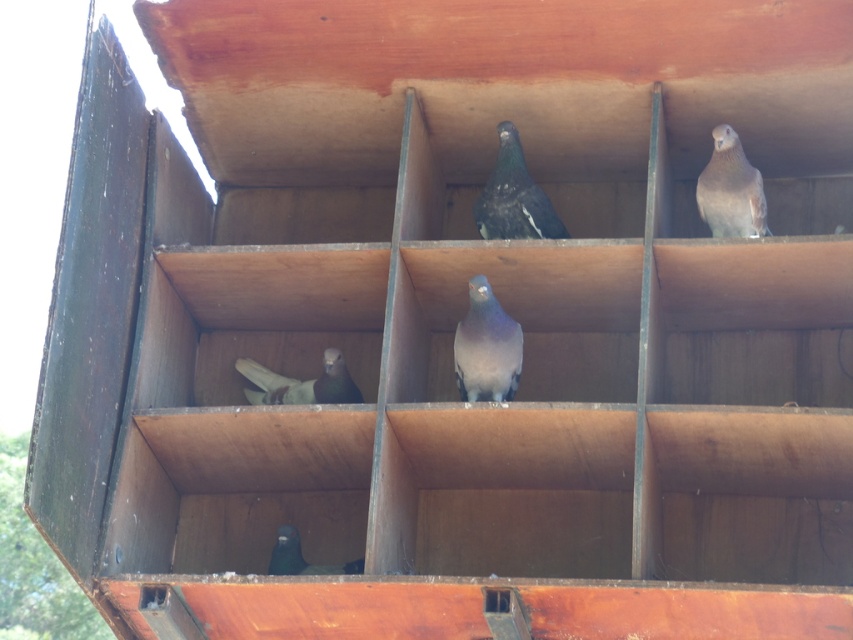
Which is behind, point (294, 532) or point (273, 561)?

The point (294, 532) is more distant.

Measure the distance between point (291,557) and camera.

They are 24.68 meters apart.

Locate an element on the screen. This screenshot has width=853, height=640. shiny black pigeon at lower center is located at coordinates (302, 557).

How much distance is there between gray matte pigeon at upper right and matte gray pigeon at lower left?

The distance of gray matte pigeon at upper right from matte gray pigeon at lower left is 7.76 meters.

This screenshot has height=640, width=853. In order to click on gray matte pigeon at upper right in this screenshot , I will do `click(730, 189)`.

Does shiny dark blue pigeon at center have a lesser height compared to gray matte pigeon at upper right?

Incorrect, shiny dark blue pigeon at center's height does not fall short of gray matte pigeon at upper right's.

I want to click on shiny dark blue pigeon at center, so click(514, 196).